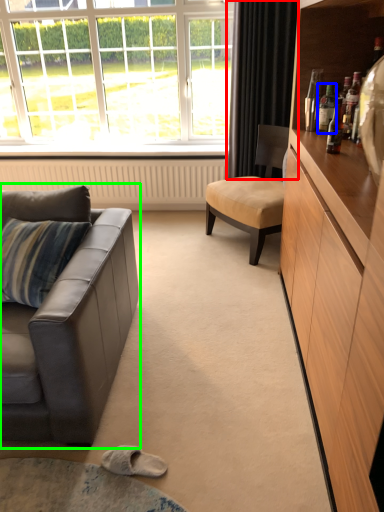
Question: Which is farther away from curtain (highlighted by a red box)? bottle (highlighted by a blue box) or studio couch (highlighted by a green box)?

Choices:
 (A) bottle
 (B) studio couch

Answer: (B)